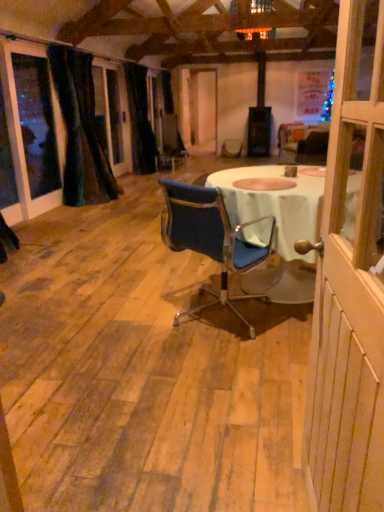
This screenshot has height=512, width=384. I want to click on free space underneath blue fabric chair at center (from a real-world perspective), so click(219, 317).